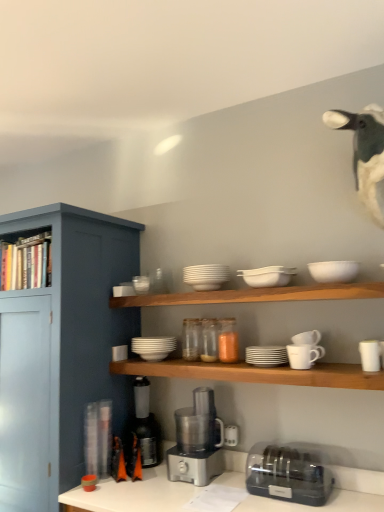
Question: From the image's perspective, is translucent glass jar at center, positioned as the eighth tableware in right-to-left order, positioned above or below white matte cup at right, the 9th tableware from the left?

Choices:
 (A) above
 (B) below

Answer: (B)

Question: In the image, is translucent glass jar at center, the second tableware in the left-to-right sequence, positioned in front of or behind white matte cup at right, the 9th tableware from the left?

Choices:
 (A) front
 (B) behind

Answer: (B)

Question: Which object is positioned farthest from the clear plastic toaster at lower right?

Choices:
 (A) metallic silver coffee machine at lower center, which is the second coffee machine in right-to-left order
 (B) white fabric duck at upper right
 (C) white matte bowl at upper right, the 8th tableware viewed from the left
 (D) white matte plate at center, placed as the 3th tableware when sorted from left to right
 (E) satin silver food processor at center, the 1th coffee machine from the right

Answer: (B)

Question: Considering the real-world distances, which object is closest to the white matte mug at right, the 4th tableware from the right?

Choices:
 (A) white matte plate at center, arranged as the 7th tableware when viewed from the right
 (B) white matte bowl at upper right, arranged as the 2th tableware when viewed from the right
 (C) satin silver food processor at center, the 1th coffee machine from the right
 (D) white matte cup at right, the 9th tableware from the left
 (E) white matte bowls at center, placed as the fourth tableware when sorted from left to right

Answer: (D)